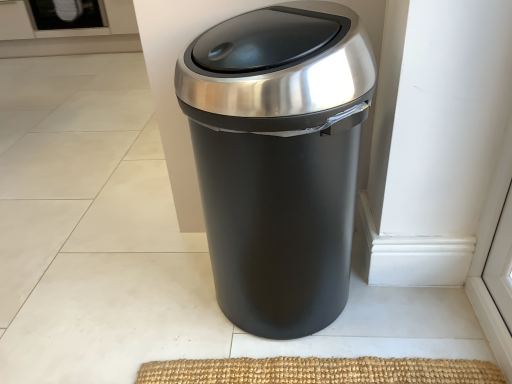
Question: From a real-world perspective, is black glass screen door at upper left physically located above or below matte black trash can at center?

Choices:
 (A) below
 (B) above

Answer: (A)

Question: Is point (86, 8) positioned closer to the camera than point (296, 97)?

Choices:
 (A) closer
 (B) farther

Answer: (B)

Question: From the image's perspective, is black glass screen door at upper left positioned above or below matte black trash can at center?

Choices:
 (A) below
 (B) above

Answer: (B)

Question: From the image's perspective, is matte black trash can at center above or below black glass screen door at upper left?

Choices:
 (A) below
 (B) above

Answer: (A)

Question: Choose the correct answer: Is matte black trash can at center inside black glass screen door at upper left or outside it?

Choices:
 (A) inside
 (B) outside

Answer: (B)

Question: Looking at the image, does matte black trash can at center seem bigger or smaller compared to black glass screen door at upper left?

Choices:
 (A) small
 (B) big

Answer: (B)

Question: Considering the positions of matte black trash can at center and black glass screen door at upper left in the image, is matte black trash can at center taller or shorter than black glass screen door at upper left?

Choices:
 (A) tall
 (B) short

Answer: (A)